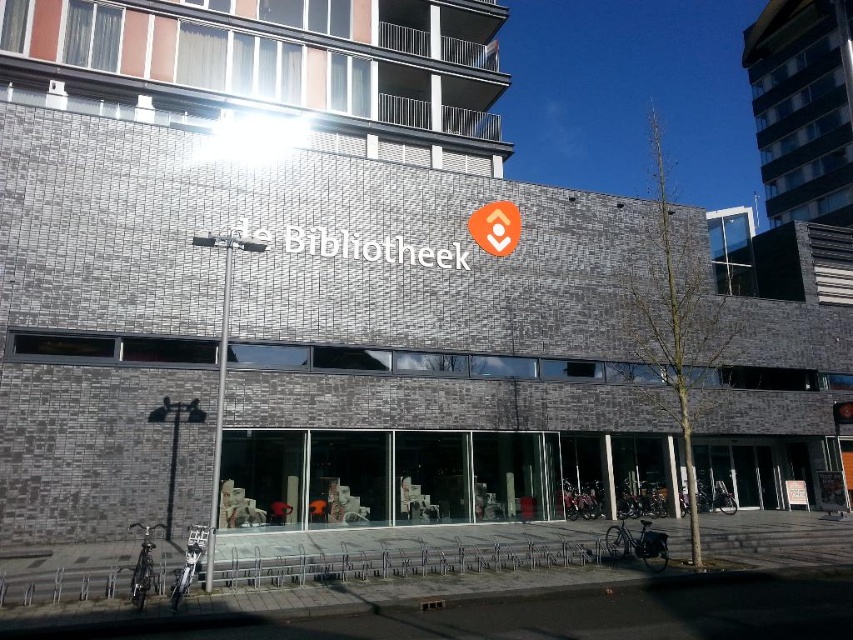
You are a tourist trying to find the library entrance. You see both the metallic silver street sign at center and the orange fabric sign at center. Which one is located to the left when facing the building?

The metallic silver street sign at center is to the left of the orange fabric sign at center.

You are a delivery person trying to read the signs on the building. Which sign, the metallic silver street sign at center or the orange fabric sign at center, can you read more easily from a distance?

The metallic silver street sign at center is thinner than orange fabric sign at center, so the orange fabric sign at center is wider and easier to read from a distance.